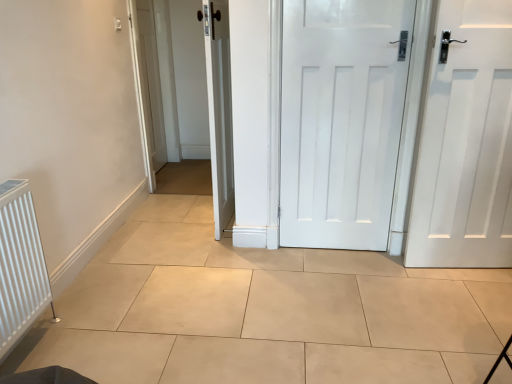
Where is `free area below white ribbed radiator at left (from a real-world perspective)`? The image size is (512, 384). free area below white ribbed radiator at left (from a real-world perspective) is located at coordinates (33, 346).